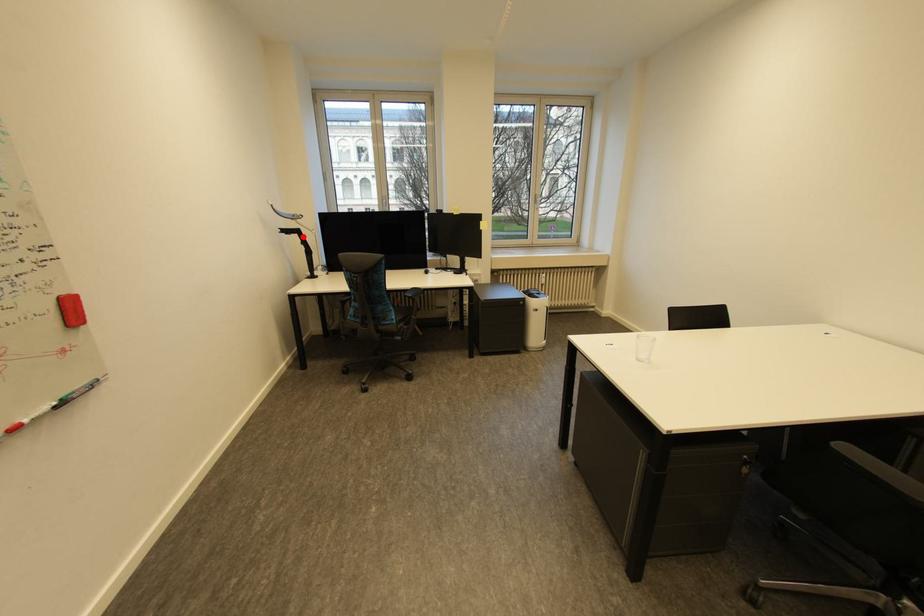
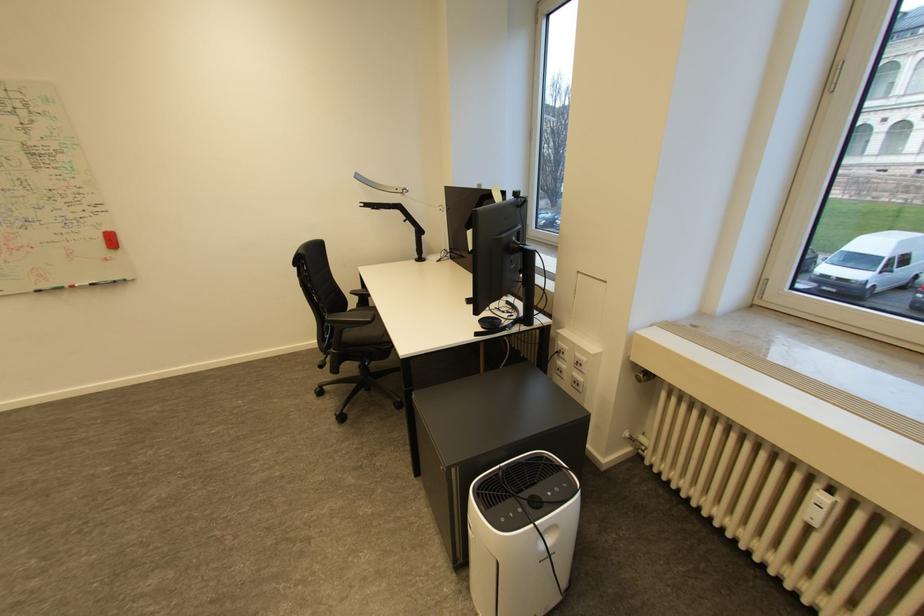
Find the pixel in the second image that matches the highlighted location in the first image.

(405, 213)